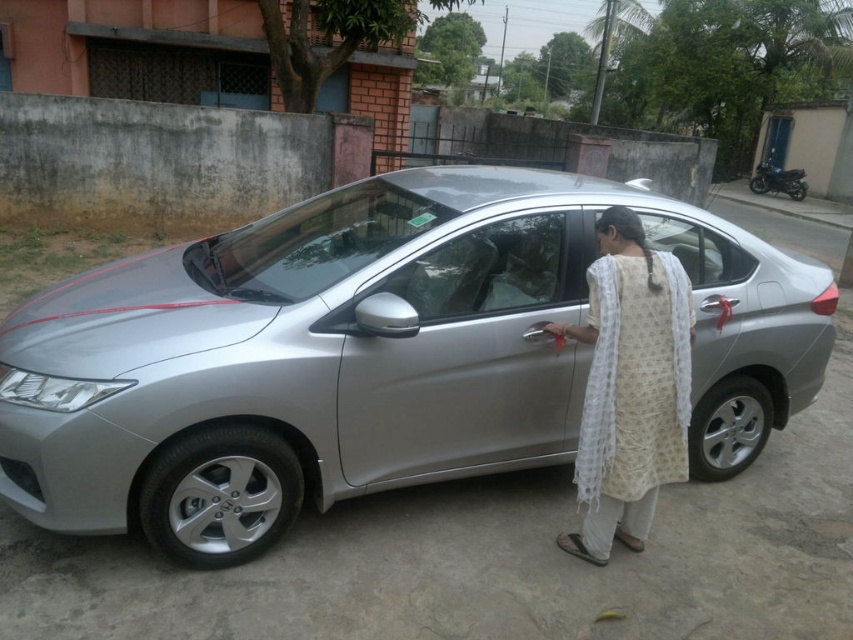
Does satin silver car at center have a larger size compared to white printed robe at center?

Correct, satin silver car at center is larger in size than white printed robe at center.

Is satin silver car at center wider than white printed robe at center?

Indeed, satin silver car at center has a greater width compared to white printed robe at center.

Which is in front, point (194, 508) or point (633, 412)?

Point (633, 412) is in front.

Identify the location of satin silver car at center. (372, 355).